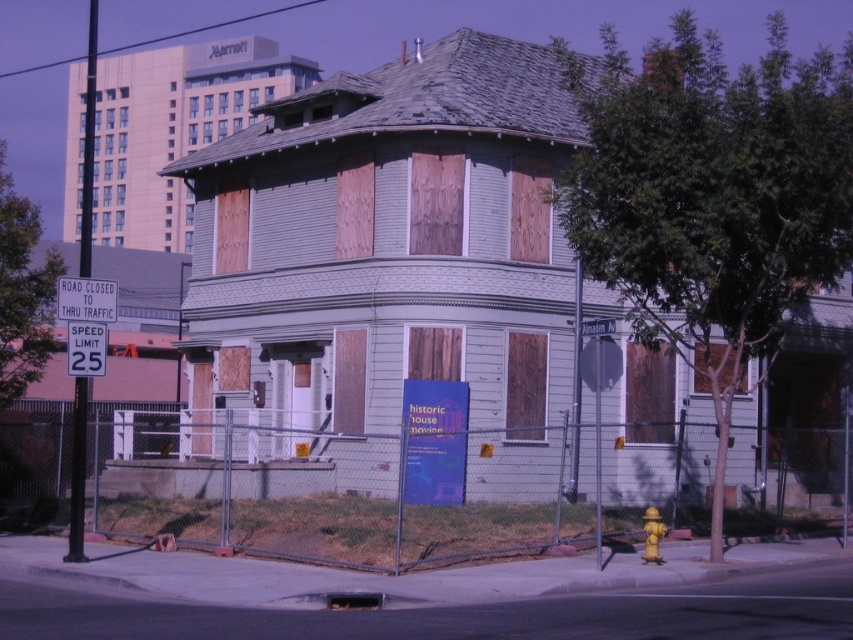
Based on the photo, you are driving and see a white plastic road sign at upper left. Is there a point at coordinate (86, 300) on it?

Yes, the point at coordinate (86, 300) is on the white plastic road sign at upper left.